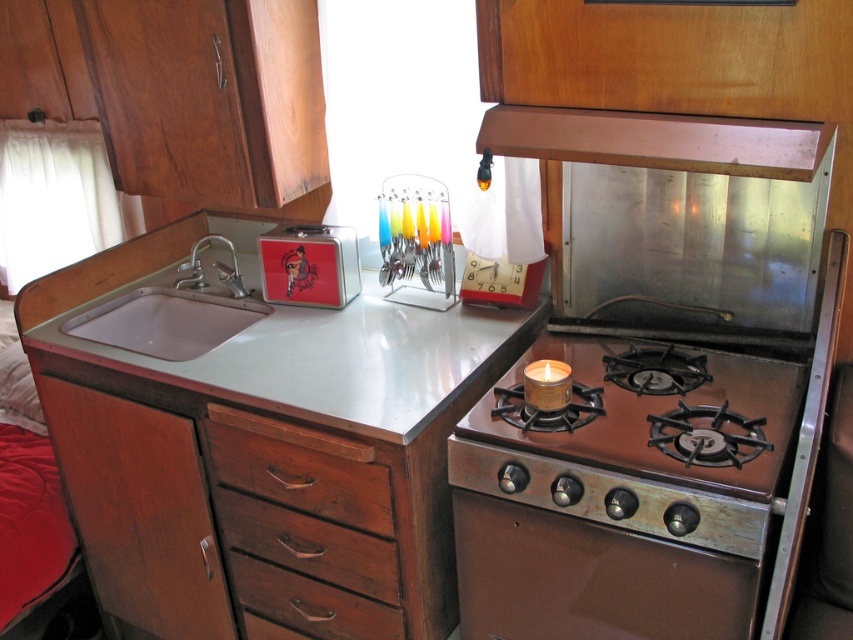
Can you confirm if wooden drawer at lower left is shorter than brown metallic oven at center?

Incorrect, wooden drawer at lower left's height does not fall short of brown metallic oven at center's.

Which is behind, point (334, 531) or point (480, 573)?

Positioned behind is point (334, 531).

Locate an element on the screen. The width and height of the screenshot is (853, 640). wooden drawer at lower left is located at coordinates (303, 529).

Which is behind, point (488, 438) or point (223, 275)?

The point (223, 275) is behind.

Who is higher up, shiny metallic gas stove at right or white glossy sink at left?

white glossy sink at left

Locate an element on the screen. This screenshot has height=640, width=853. shiny metallic gas stove at right is located at coordinates [x=653, y=412].

Find the location of `shiny metallic gas stove at right`. shiny metallic gas stove at right is located at coordinates (653, 412).

Does brown metallic oven at center appear under shiny metallic gas stove at right?

Correct, brown metallic oven at center is located below shiny metallic gas stove at right.

Is point (640, 566) behind point (595, 458)?

That is True.

Which is in front, point (538, 637) or point (521, 372)?

Positioned in front is point (538, 637).

At what (x,y) coordinates should I click in order to perform the action: click on brown metallic oven at center. Please return your answer as a coordinate pair (x, y). The width and height of the screenshot is (853, 640). Looking at the image, I should click on (589, 579).